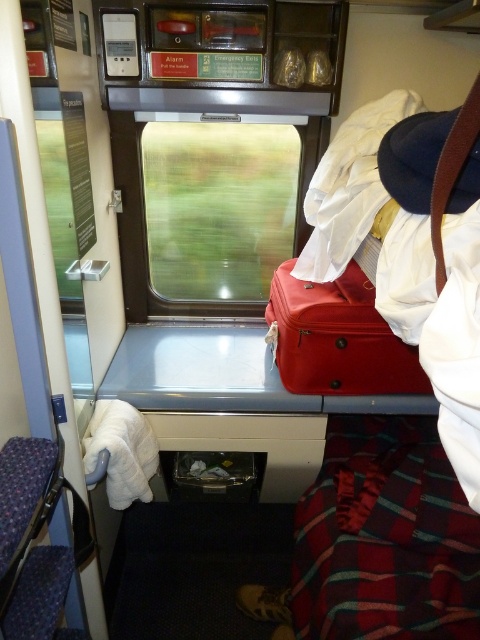
Does transparent glass window at center have a greater width compared to matte red suitcase at center?

Yes, transparent glass window at center is wider than matte red suitcase at center.

Measure the distance between transparent glass window at center and matte red suitcase at center.

transparent glass window at center and matte red suitcase at center are 16.21 inches apart.

What are the coordinates of `transparent glass window at center` in the screenshot? It's located at (217, 208).

Identify the location of transparent glass window at center. The height and width of the screenshot is (640, 480). (217, 208).